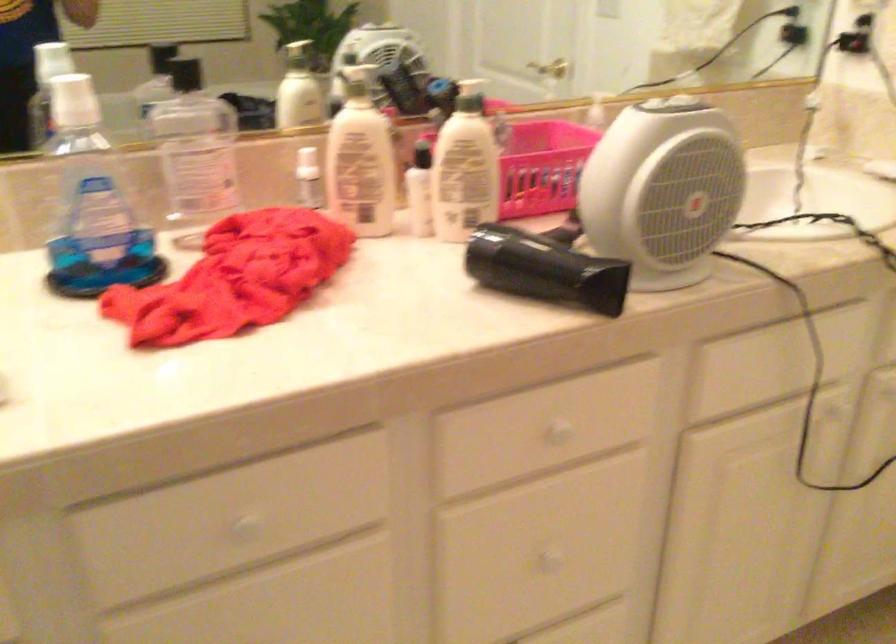
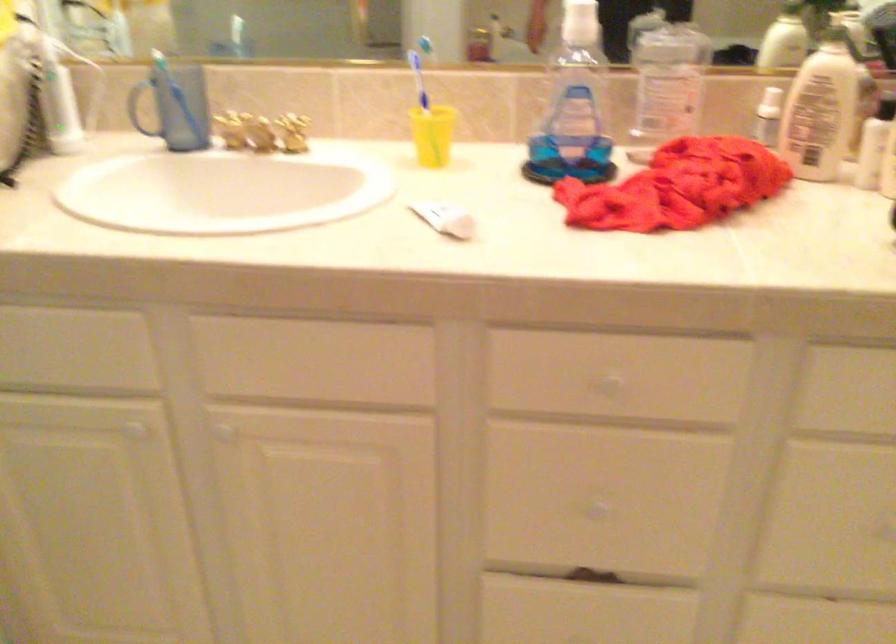
Where in the second image is the point corresponding to point (245, 524) from the first image?

(609, 384)